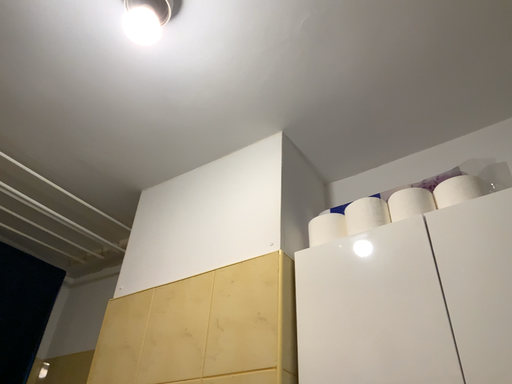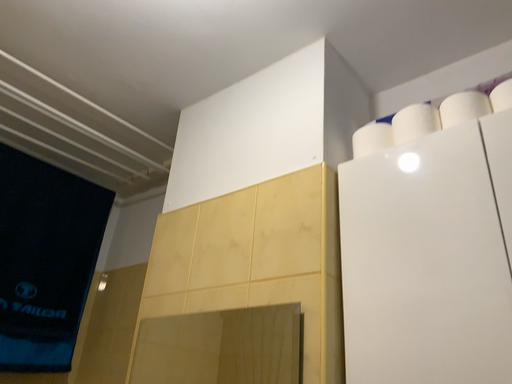
Question: Which way did the camera rotate in the video?

Choices:
 (A) rotated upward
 (B) rotated downward

Answer: (B)